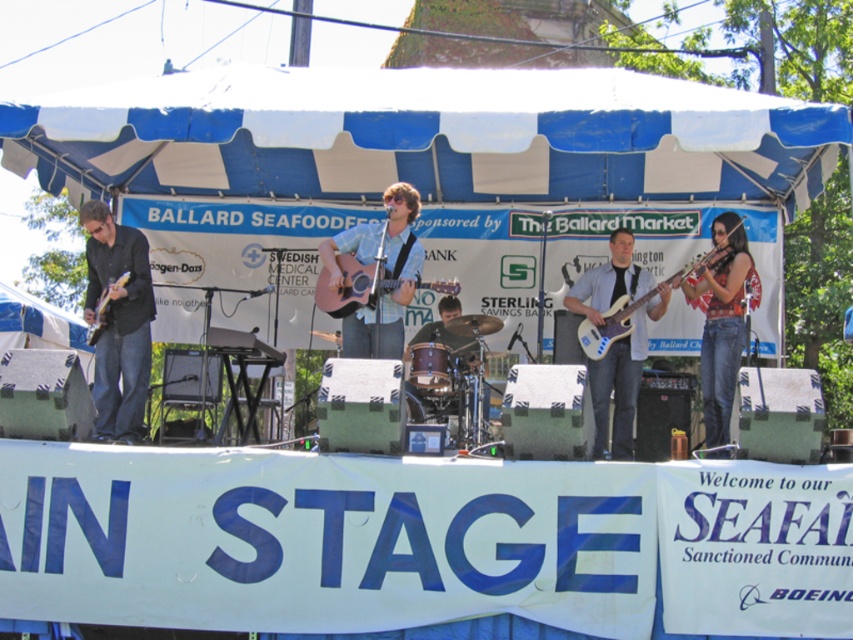
Who is lower down, denim jeans at right or glossy electric guitar at center-right?

denim jeans at right is below.

Does denim jeans at right have a greater height compared to glossy electric guitar at center-right?

Yes.

Which is in front, point (735, 289) or point (585, 339)?

Positioned in front is point (735, 289).

The image size is (853, 640). I want to click on denim jeans at right, so click(x=721, y=323).

Consider the image. Can you confirm if black leather jacket at left is positioned to the right of light blue fabric guitar at center?

No, black leather jacket at left is not to the right of light blue fabric guitar at center.

Is point (111, 371) positioned after point (395, 346)?

That is True.

You are a GUI agent. You are given a task and a screenshot of the screen. Output one action in this format:
    pyautogui.click(x=<x>, y=<y>)
    Task: Click on the black leather jacket at left
    
    Given the screenshot: What is the action you would take?
    pyautogui.click(x=119, y=321)

Between point (384, 248) and point (86, 342), which one is positioned in front?

Point (384, 248) is in front.

Can you confirm if light blue fabric guitar at center is positioned to the right of matte brown acoustic guitar at left?

Indeed, light blue fabric guitar at center is positioned on the right side of matte brown acoustic guitar at left.

Find the location of a particular element. light blue fabric guitar at center is located at coordinates (386, 273).